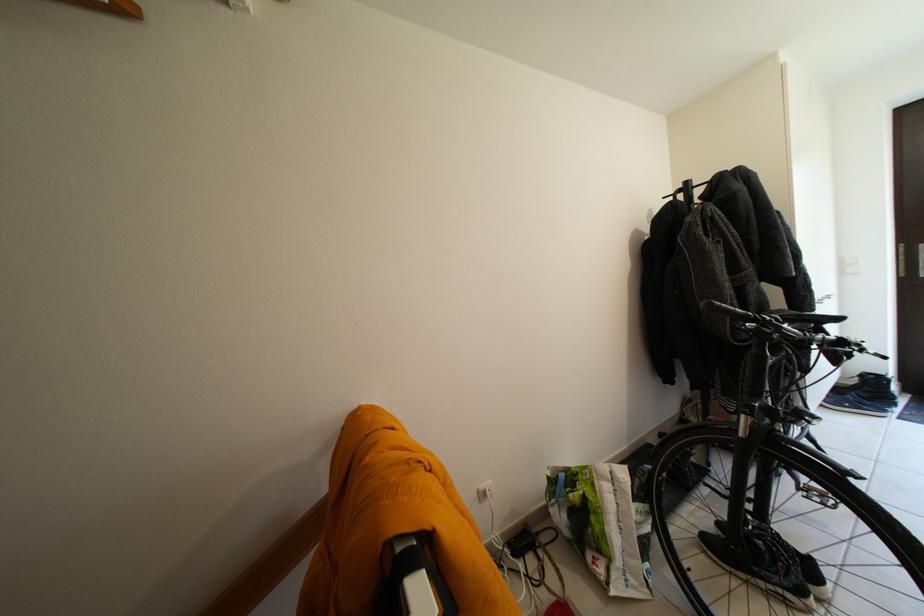
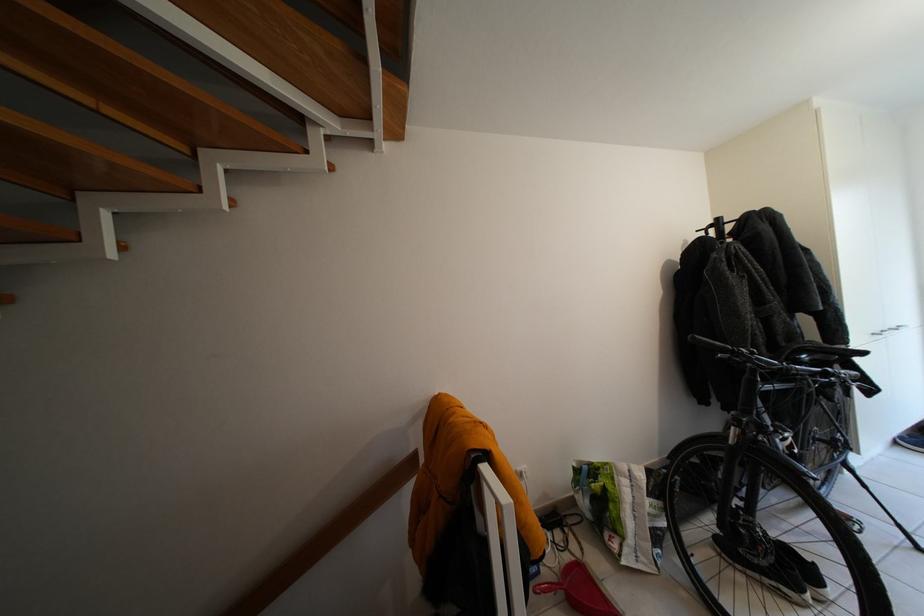
The point at (x=642, y=522) is marked in the first image. Where is the corresponding point in the second image?

(657, 515)